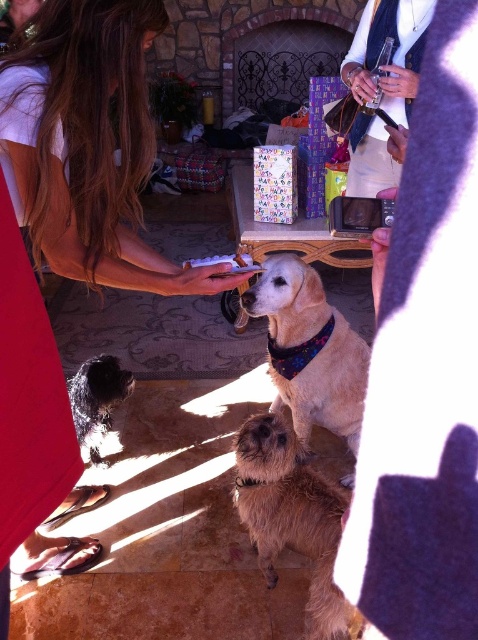
You are a service robot in the living room. You need to move from the black fuzzy dog at lower left to the matte white shirt at center. What is the minimum distance you need to travel in inches?

The minimum distance you need to travel is 39.26 inches to reach the matte white shirt at center from the black fuzzy dog at lower left.

Looking at this image, you are a guest at this gathering and notice the matte white shirt at center and the shaggy brown dog at center. From your perspective, which object is positioned to the left?

The matte white shirt at center is to the left of the shaggy brown dog at center.

You are a guest at the gathering and see the matte white shirt at center and the white paper at center. Which one is closer to your right side?

The white paper at center is closer to your right side because the matte white shirt at center is to the left of it.